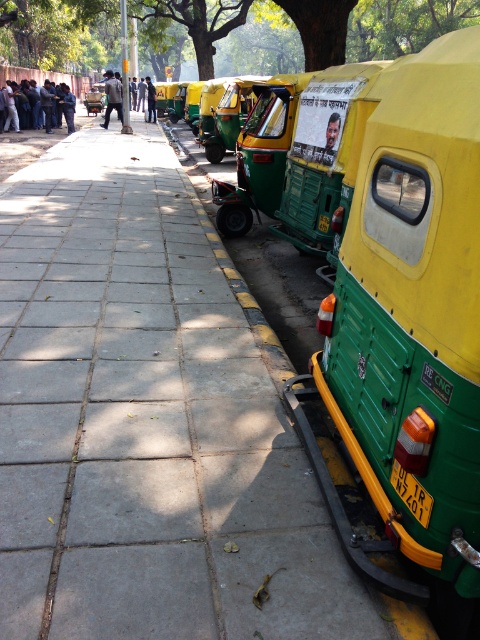
Question: Is green leafy tree at upper center in front of dark blue jacket at upper left?

Choices:
 (A) no
 (B) yes

Answer: (B)

Question: Which object is farther from the camera taking this photo?

Choices:
 (A) dark blue shirt at left
 (B) green leafy tree at upper center

Answer: (A)

Question: Estimate the real-world distances between objects in this image. Which object is closer to the yellow matte license plate at lower right?

Choices:
 (A) dark blue shirt at center
 (B) dark blue shirt at left

Answer: (B)

Question: Which point appears farthest from the camera in this image?

Choices:
 (A) (379, 445)
 (B) (424, 516)

Answer: (A)

Question: Does paved concrete sidewalk at center have a smaller size compared to dark blue jacket at upper left?

Choices:
 (A) yes
 (B) no

Answer: (A)

Question: Where is dark blue uniform at center located in relation to yellow plastic license plate at right in the image?

Choices:
 (A) left
 (B) right

Answer: (A)